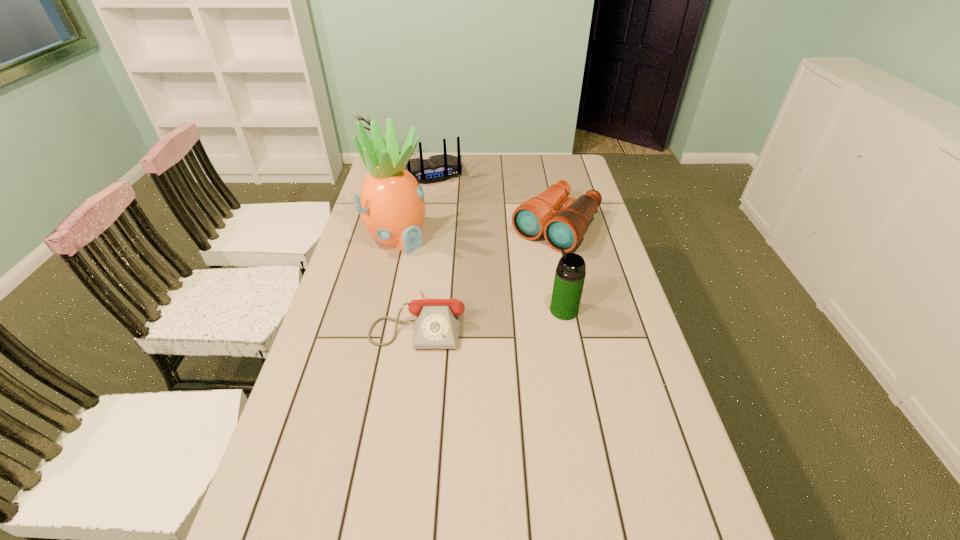
This screenshot has height=540, width=960. What are the coordinates of `telephone that is at the left edge` in the screenshot? It's located at (437, 323).

The width and height of the screenshot is (960, 540). Find the location of `pineapple positioned at the left edge`. pineapple positioned at the left edge is located at coordinates [x=391, y=203].

This screenshot has height=540, width=960. In order to click on router at the left edge in this screenshot , I will do `click(437, 168)`.

Locate an element on the screen. thermos bottle that is at the right edge is located at coordinates (570, 273).

Locate an element on the screen. The width and height of the screenshot is (960, 540). binoculars present at the right edge is located at coordinates (564, 229).

Identify the location of object present at the far left corner. (437, 168).

Find the location of `free space at the far edge of the desktop`. free space at the far edge of the desktop is located at coordinates (468, 171).

The width and height of the screenshot is (960, 540). Identify the location of free space at the near edge. (370, 508).

Locate an element on the screen. Image resolution: width=960 pixels, height=540 pixels. vacant space at the left edge of the desktop is located at coordinates (341, 355).

This screenshot has width=960, height=540. Identify the location of vacant space at the right edge. (660, 400).